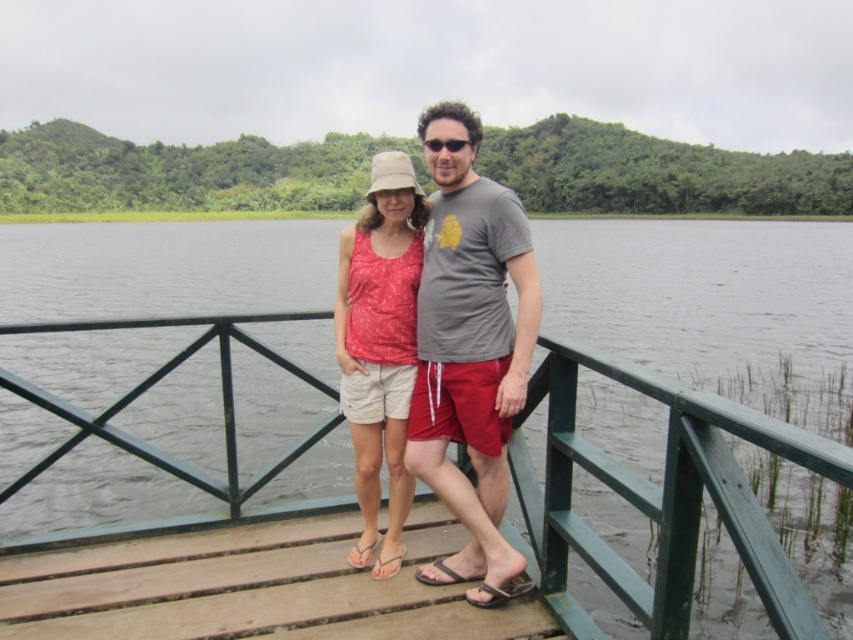
Question: Which of the following is the farthest from the observer?

Choices:
 (A) wooden dock at center
 (B) matte gray t-shirt at center

Answer: (B)

Question: Which object is farther from the camera taking this photo?

Choices:
 (A) wooden dock at center
 (B) green painted wood at center
 (C) matte gray t-shirt at center
 (D) matte pink tank top at center

Answer: (D)

Question: In this image, where is matte gray t-shirt at center located relative to matte pink tank top at center?

Choices:
 (A) above
 (B) below

Answer: (A)

Question: Can you confirm if wooden dock at center is thinner than matte pink tank top at center?

Choices:
 (A) no
 (B) yes

Answer: (A)

Question: Which is nearer to the green painted wood at center?

Choices:
 (A) matte gray t-shirt at center
 (B) sunglasses at center

Answer: (A)

Question: Is the position of green painted wood at center less distant than that of wooden dock at center?

Choices:
 (A) no
 (B) yes

Answer: (B)